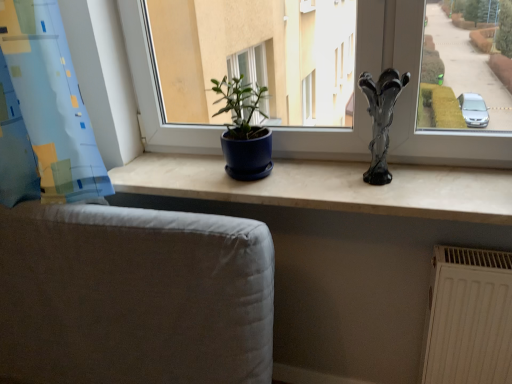
Question: Can you confirm if matte blue pot at center is taller than matte blue pot at center?

Choices:
 (A) yes
 (B) no

Answer: (A)

Question: Is matte blue pot at center directly adjacent to matte blue pot at center?

Choices:
 (A) yes
 (B) no

Answer: (B)

Question: Does matte blue pot at center have a lesser height compared to matte blue pot at center?

Choices:
 (A) no
 (B) yes

Answer: (A)

Question: Does matte blue pot at center lie in front of matte blue pot at center?

Choices:
 (A) yes
 (B) no

Answer: (B)

Question: From the image's perspective, would you say matte blue pot at center is positioned over matte blue pot at center?

Choices:
 (A) no
 (B) yes

Answer: (B)

Question: Could matte blue pot at center be considered to be inside matte blue pot at center?

Choices:
 (A) no
 (B) yes

Answer: (A)

Question: Considering the relative sizes of gray fabric armchair at lower left and matte blue pot at center in the image provided, is gray fabric armchair at lower left taller than matte blue pot at center?

Choices:
 (A) yes
 (B) no

Answer: (A)

Question: From a real-world perspective, is gray fabric armchair at lower left on matte blue pot at center?

Choices:
 (A) yes
 (B) no

Answer: (B)

Question: Can you confirm if gray fabric armchair at lower left is wider than matte blue pot at center?

Choices:
 (A) yes
 (B) no

Answer: (A)

Question: Can you confirm if gray fabric armchair at lower left is shorter than matte blue pot at center?

Choices:
 (A) yes
 (B) no

Answer: (B)

Question: Can you confirm if gray fabric armchair at lower left is positioned to the left of matte blue pot at center?

Choices:
 (A) yes
 (B) no

Answer: (A)

Question: Is gray fabric armchair at lower left behind matte blue pot at center?

Choices:
 (A) no
 (B) yes

Answer: (A)

Question: Is matte blue pot at center shorter than white textured radiator at lower right?

Choices:
 (A) no
 (B) yes

Answer: (B)